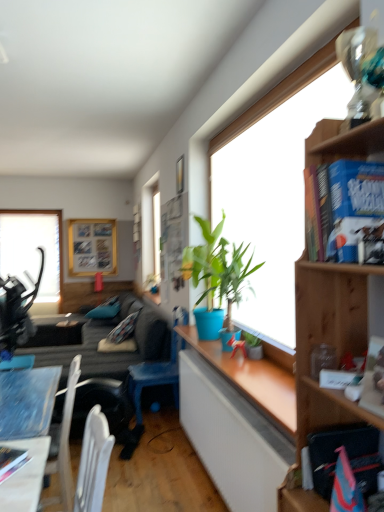
The height and width of the screenshot is (512, 384). What are the coordinates of `free location above hardcover book at lower left, placed as the first book when sorted from left to right (from a real-world perspective)` in the screenshot? It's located at (6, 455).